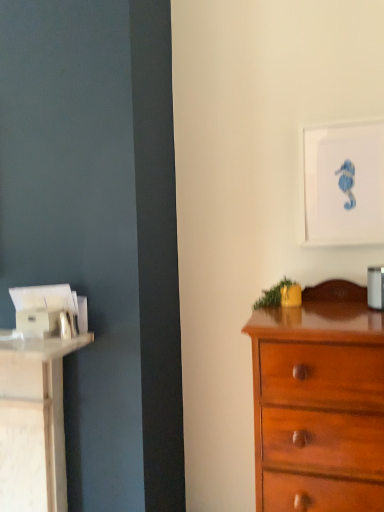
Question: Would you say glossy wood chest of drawers at right is to the left or to the right of white matte picture frame at upper right in the picture?

Choices:
 (A) left
 (B) right

Answer: (A)

Question: Is point (289, 333) closer or farther from the camera than point (380, 223)?

Choices:
 (A) closer
 (B) farther

Answer: (A)

Question: Is glossy wood chest of drawers at right inside or outside of white matte picture frame at upper right?

Choices:
 (A) inside
 (B) outside

Answer: (B)

Question: In terms of width, does white matte picture frame at upper right look wider or thinner when compared to glossy wood chest of drawers at right?

Choices:
 (A) thin
 (B) wide

Answer: (A)

Question: Is white matte picture frame at upper right inside the boundaries of glossy wood chest of drawers at right, or outside?

Choices:
 (A) outside
 (B) inside

Answer: (A)

Question: From the image's perspective, is white matte picture frame at upper right located above or below glossy wood chest of drawers at right?

Choices:
 (A) above
 (B) below

Answer: (A)

Question: Considering the positions of white matte picture frame at upper right and glossy wood chest of drawers at right in the image, is white matte picture frame at upper right taller or shorter than glossy wood chest of drawers at right?

Choices:
 (A) short
 (B) tall

Answer: (A)